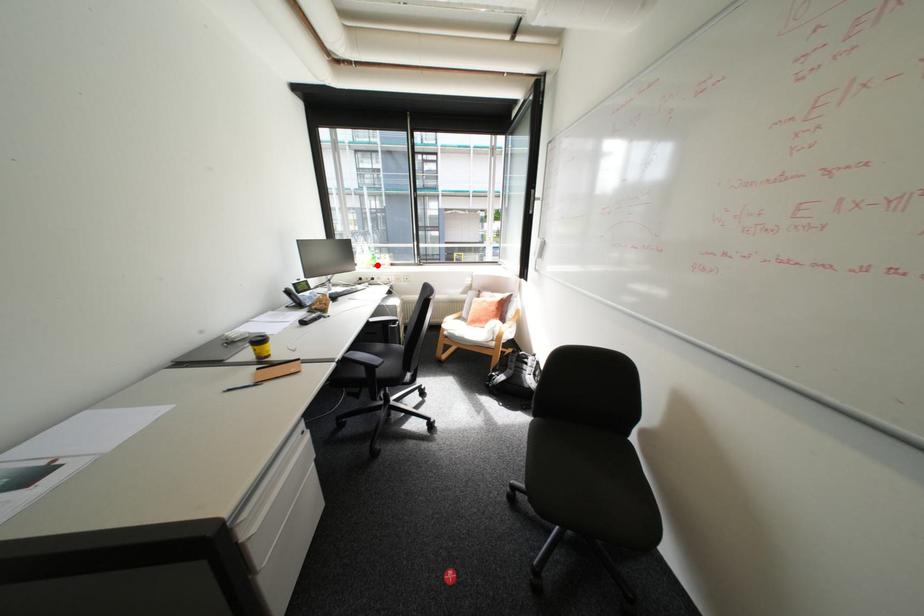
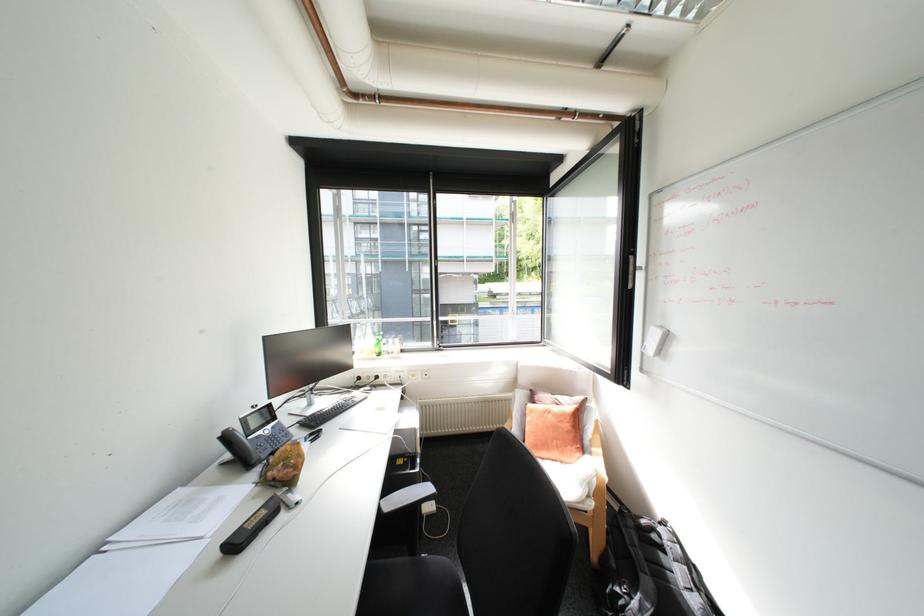
Question: A red point is marked in image1. In image2, is the corresponding 3D point closer to the camera or farther? Reply with the corresponding letter.

Choices:
 (A) The corresponding 3D point is closer.
 (B) The corresponding 3D point is farther.

Answer: (B)